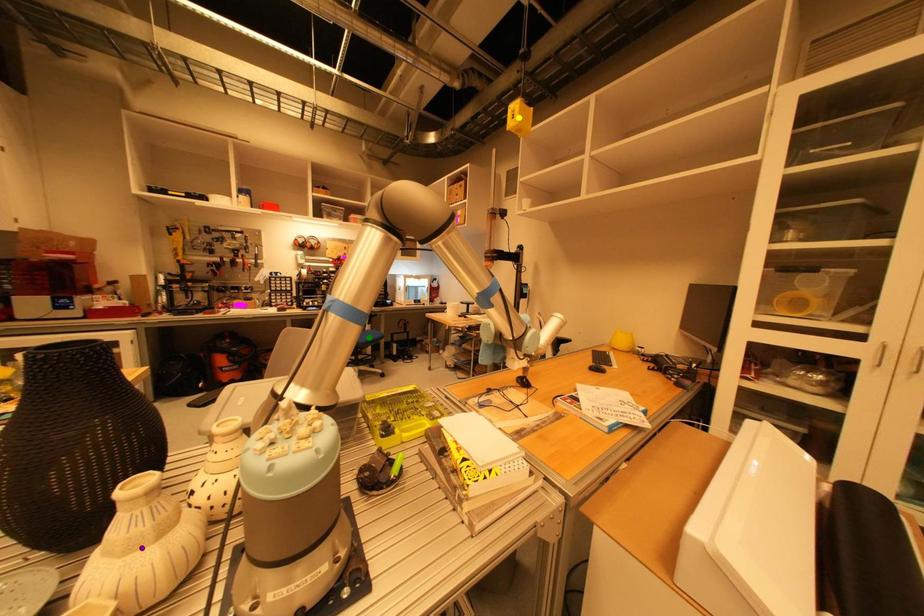
Order these from nearest to farthest:
1. green point
2. yellow point
3. purple point

purple point → yellow point → green point